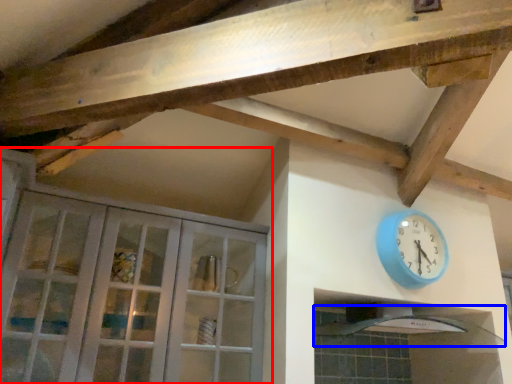
Question: Among these objects, which one is nearest to the camera, cabinetry (highlighted by a red box) or exhaust hood (highlighted by a blue box)?

Choices:
 (A) cabinetry
 (B) exhaust hood

Answer: (A)